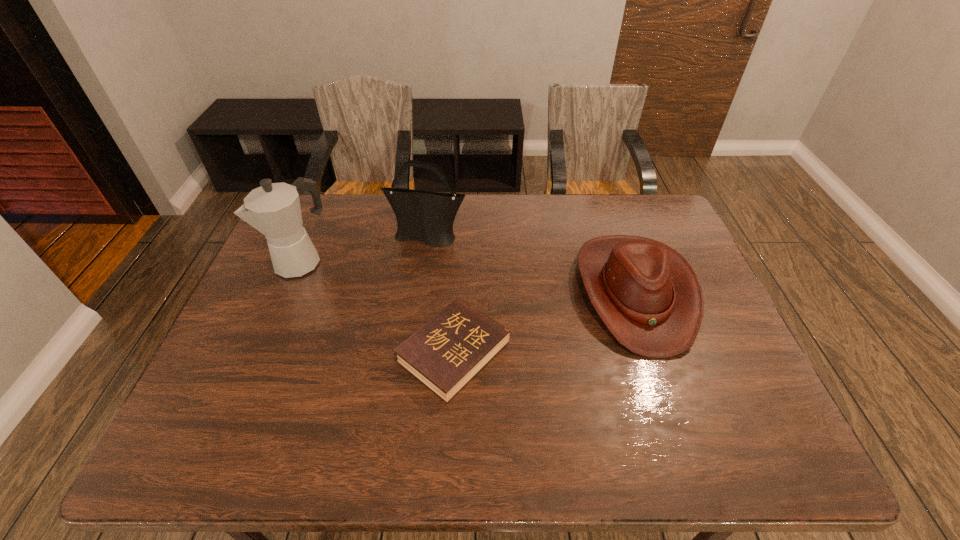
At what (x,y) coordinates should I click in order to perform the action: click on coffeepot. Please return your answer as a coordinate pair (x, y). This screenshot has height=540, width=960. Looking at the image, I should click on (273, 209).

Locate an element on the screen. shoulder bag is located at coordinates (428, 217).

This screenshot has width=960, height=540. I want to click on the third tallest object, so click(648, 296).

The width and height of the screenshot is (960, 540). In order to click on cowboy hat in this screenshot , I will do `click(648, 296)`.

Image resolution: width=960 pixels, height=540 pixels. Find the location of `the shortest object`. the shortest object is located at coordinates (447, 352).

In order to click on blank area located 0.360m on the right of the leftmost object in this screenshot , I will do `click(448, 261)`.

At what (x,y) coordinates should I click in order to perform the action: click on blank space located 0.170m on the left of the shoulder bag. Please return your answer as a coordinate pair (x, y). The height and width of the screenshot is (540, 960). Looking at the image, I should click on (334, 238).

Locate an element on the screen. The image size is (960, 540). vacant space located on the front-facing side of the third tallest object is located at coordinates (672, 400).

Locate an element on the screen. The width and height of the screenshot is (960, 540). vacant area situated on the right of the hardback book is located at coordinates (657, 352).

Locate an element on the screen. object positioned at the far edge is located at coordinates (428, 217).